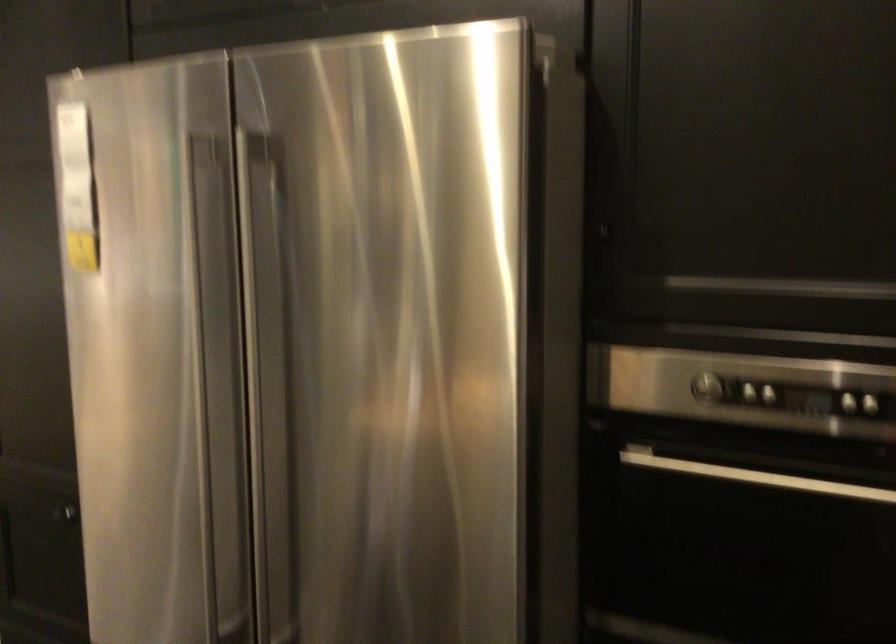
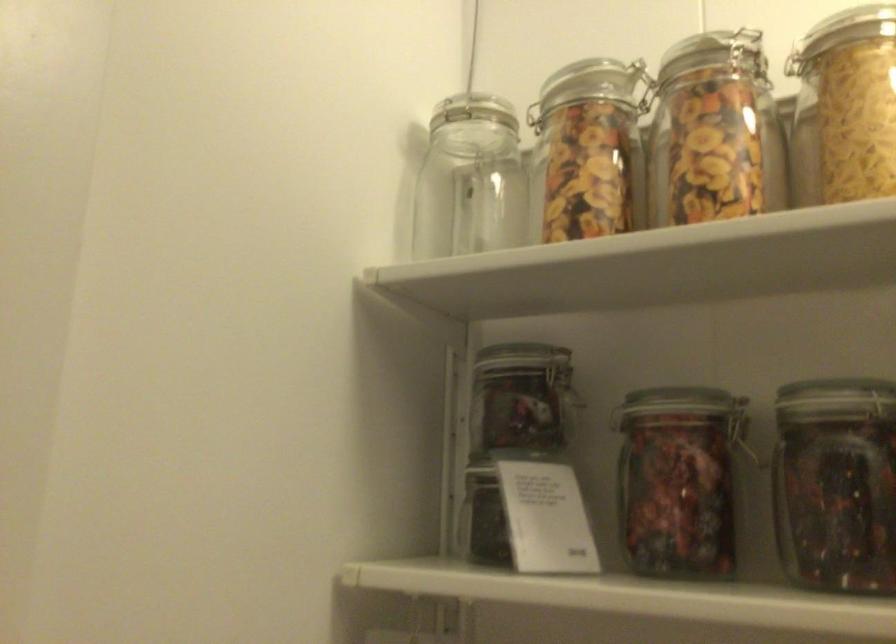
Which direction would the cameraman need to move to produce the second image?

The cameraman walked toward right, forward.